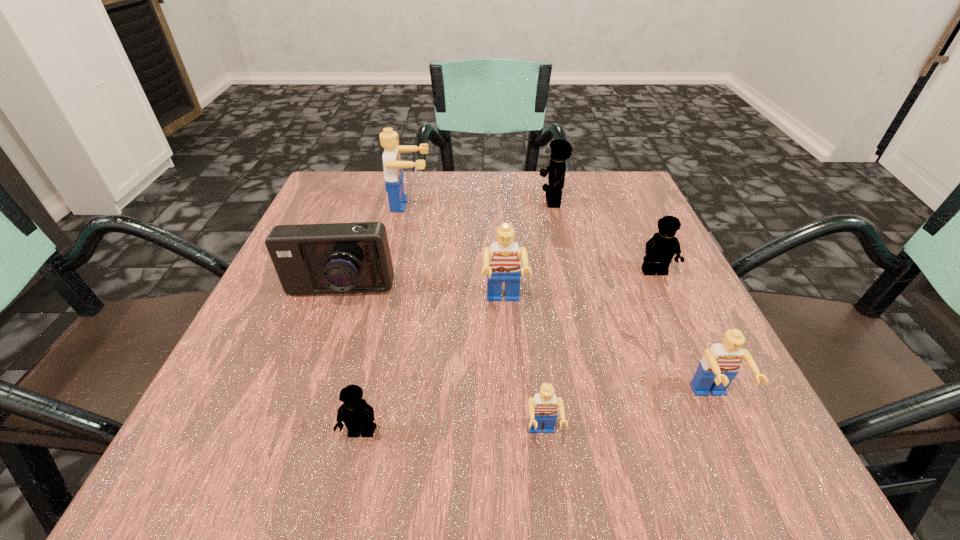
Identify the location of the tallest Lego. (393, 167).

Locate an element on the screen. The height and width of the screenshot is (540, 960). the leftmost blue Lego is located at coordinates (393, 167).

Locate an element on the screen. This screenshot has height=540, width=960. the third object from right to left is located at coordinates (561, 150).

Where is `the farthest yellow Lego`? This screenshot has width=960, height=540. the farthest yellow Lego is located at coordinates (561, 150).

You are a GUI agent. You are given a task and a screenshot of the screen. Output one action in this format:
    pyautogui.click(x=<x>, y=<y>)
    Task: Click on the third smallest blue Lego
    
    Given the screenshot: What is the action you would take?
    pyautogui.click(x=501, y=262)

Find the location of a particular element. The image size is (960, 540). the second farthest blue Lego is located at coordinates (501, 262).

In order to click on camera in this screenshot , I will do `click(334, 258)`.

Where is `the fifth nearest Lego`? The height and width of the screenshot is (540, 960). the fifth nearest Lego is located at coordinates (660, 249).

Where is `the second smallest yellow Lego`? The width and height of the screenshot is (960, 540). the second smallest yellow Lego is located at coordinates (660, 249).

Identify the location of the third nearest object. The height and width of the screenshot is (540, 960). (716, 370).